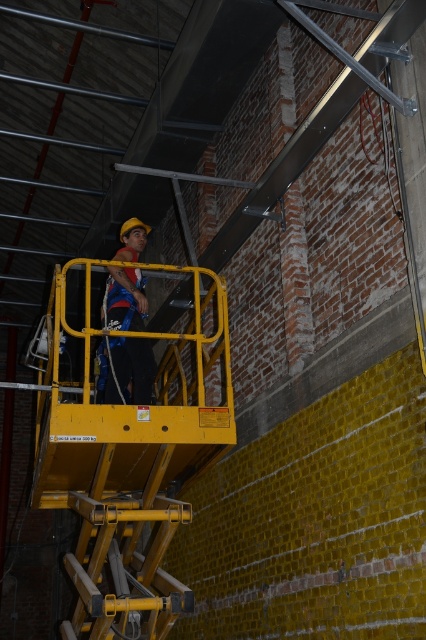
Question: Considering the relative positions of yellow metallic platform at center and matte blue safety harness at center in the image provided, where is yellow metallic platform at center located with respect to matte blue safety harness at center?

Choices:
 (A) above
 (B) below

Answer: (B)

Question: Does yellow metallic platform at center come in front of matte blue safety harness at center?

Choices:
 (A) no
 (B) yes

Answer: (B)

Question: Is yellow metallic platform at center smaller than matte blue safety harness at center?

Choices:
 (A) no
 (B) yes

Answer: (A)

Question: Which object appears closest to the camera in this image?

Choices:
 (A) yellow metallic platform at center
 (B) matte blue safety harness at center

Answer: (A)

Question: Which of the following is the farthest from the observer?

Choices:
 (A) matte blue safety harness at center
 (B) yellow metallic platform at center

Answer: (A)